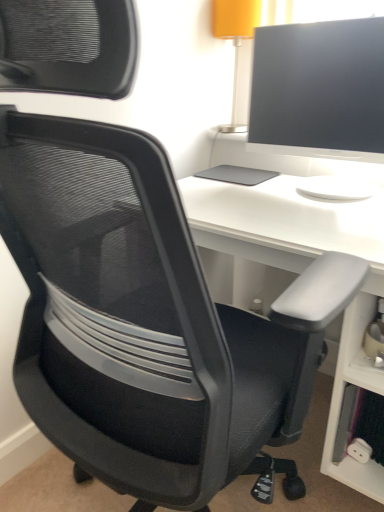
Identify the location of vacant region in front of matte black monitor at upper right. (316, 207).